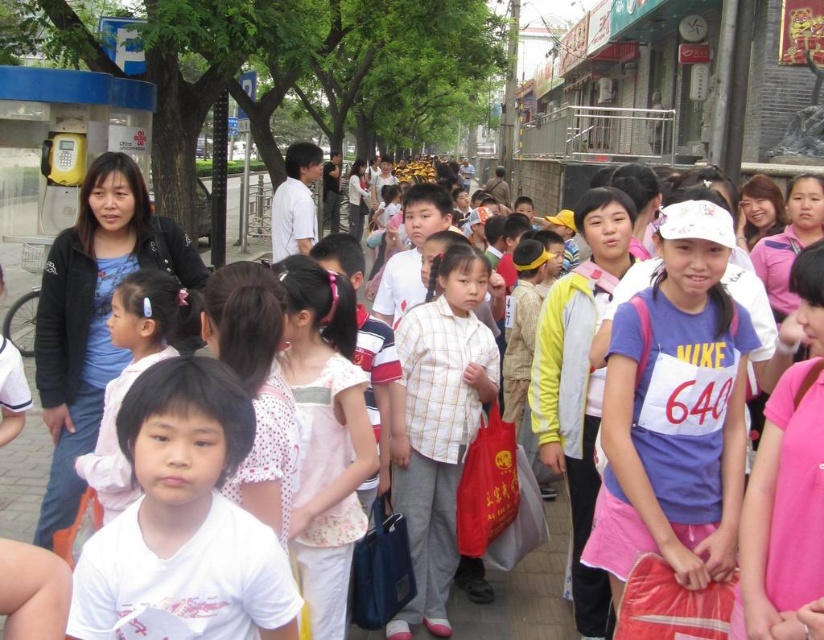
Question: Does purple cotton shirt at center have a lesser width compared to pink fabric hairband at center?

Choices:
 (A) yes
 (B) no

Answer: (B)

Question: Can you confirm if purple cotton shirt at center is wider than plaid cotton shirt at center?

Choices:
 (A) no
 (B) yes

Answer: (B)

Question: Which object is closer to the camera taking this photo?

Choices:
 (A) purple cotton shirt at center
 (B) pink fabric hairband at center

Answer: (B)

Question: Based on their relative distances, which object is nearer to the purple cotton shirt at center?

Choices:
 (A) pink fabric hairband at center
 (B) white dotted shirt at center

Answer: (B)

Question: Is purple cotton shirt at center thinner than pink fabric hairband at center?

Choices:
 (A) yes
 (B) no

Answer: (B)

Question: Which of the following is the farthest from the observer?

Choices:
 (A) plaid cotton shirt at center
 (B) pink fabric hairband at center

Answer: (A)